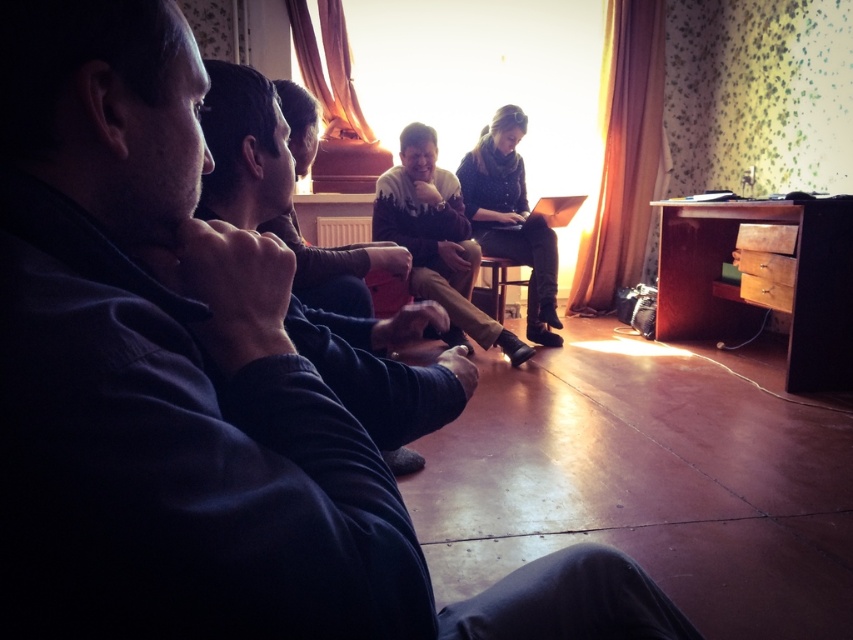
Question: Considering the real-world distances, which object is farthest from the metallic gold laptop at center?

Choices:
 (A) dark brown leather jacket at center
 (B) wooden chair at center

Answer: (B)

Question: Can you confirm if metallic gold laptop at center is positioned to the right of wooden chair at center?

Choices:
 (A) yes
 (B) no

Answer: (A)

Question: Is dark blue sweater at center behind metallic gold laptop at center?

Choices:
 (A) no
 (B) yes

Answer: (A)

Question: Does dark brown leather jacket at center appear on the right side of metallic gold laptop at center?

Choices:
 (A) yes
 (B) no

Answer: (B)

Question: Which of the following is the farthest from the observer?

Choices:
 (A) metallic gold laptop at center
 (B) dark brown leather jacket at center

Answer: (A)

Question: Among these points, which one is nearest to the camera?

Choices:
 (A) (474, 147)
 (B) (489, 266)

Answer: (B)